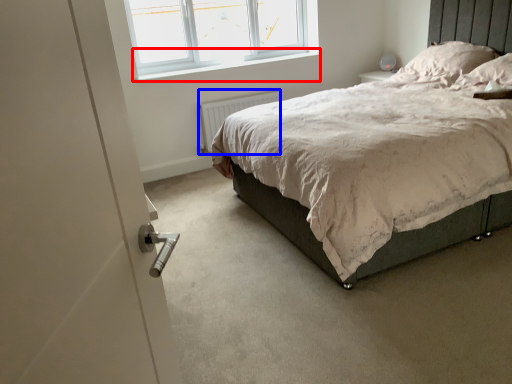
Question: Which object is closer to the camera taking this photo, window sill (highlighted by a red box) or radiator (highlighted by a blue box)?

Choices:
 (A) window sill
 (B) radiator

Answer: (A)